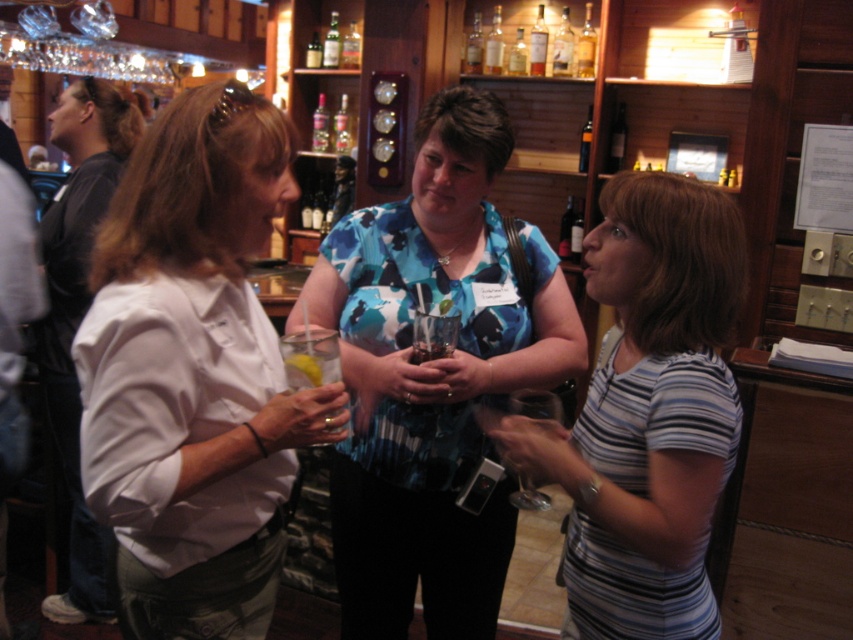
You are standing in the bar and want to reach both the point at coordinates (514, 403) and the point at coordinates (579, 170). Which point should you move towards first to reach the closer one?

You should move towards point (514, 403) first because it is closer to you than point (579, 170).